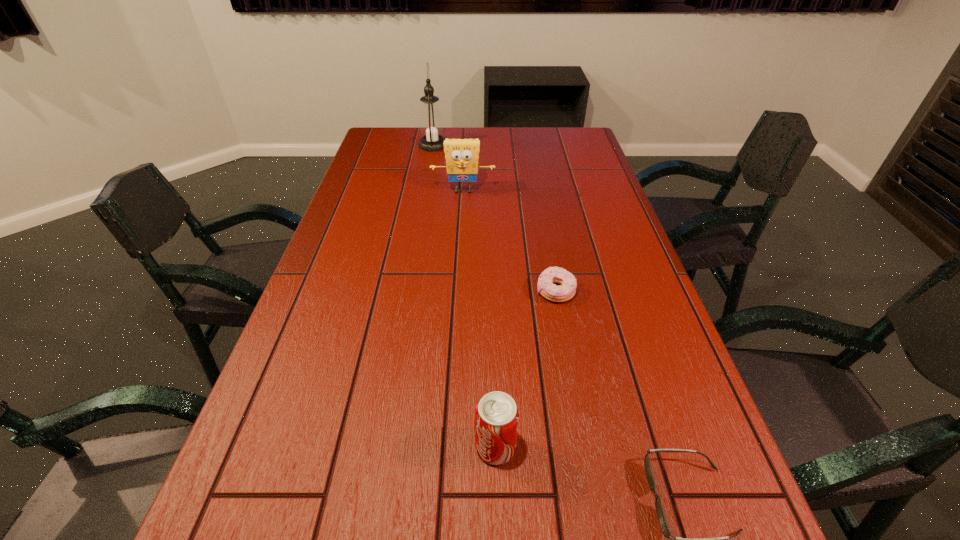
The image size is (960, 540). Find the location of `free space that is in between the doughnut and the oil lamp`. free space that is in between the doughnut and the oil lamp is located at coordinates (494, 219).

The height and width of the screenshot is (540, 960). In order to click on empty location between the soda can and the third farthest object in this screenshot , I will do `click(526, 369)`.

Locate an element on the screen. This screenshot has height=540, width=960. free space between the fourth shortest object and the soda can is located at coordinates (479, 319).

Locate which object ranks third in proximity to the third nearest object. Please provide its 2D coordinates. Your answer should be formatted as a tuple, i.e. [(x, y)], where the tuple contains the x and y coordinates of a point satisfying the conditions above.

[(461, 155)]

Identify the location of object that is the closest to the sponge. (431, 124).

Find the location of `free space in the image that satisfies the following two spatial constraints: 1. on the face of the fourth nearest object; 2. on the left side of the soda can`. free space in the image that satisfies the following two spatial constraints: 1. on the face of the fourth nearest object; 2. on the left side of the soda can is located at coordinates (449, 448).

Locate an element on the screen. vacant space that satisfies the following two spatial constraints: 1. on the face of the second farthest object; 2. on the left side of the third farthest object is located at coordinates (458, 292).